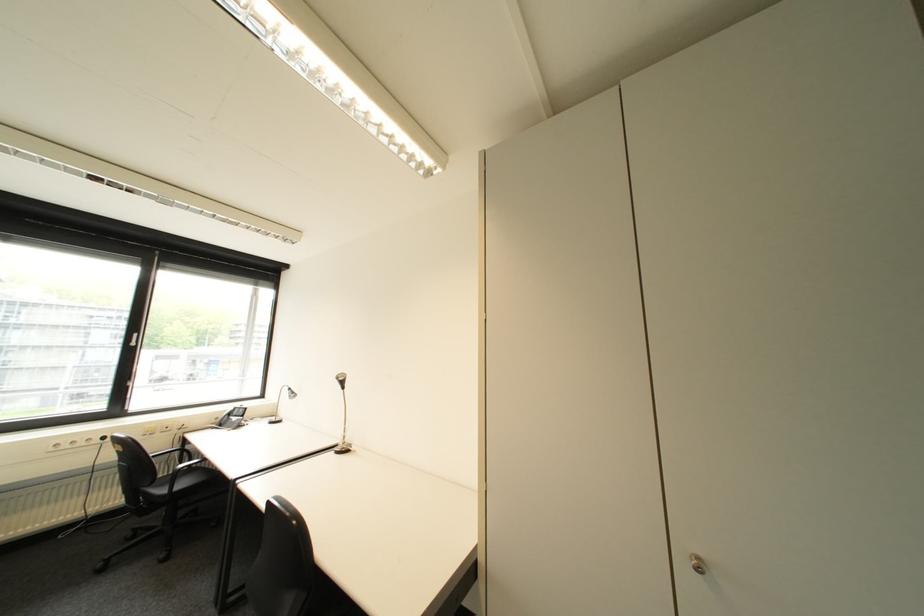
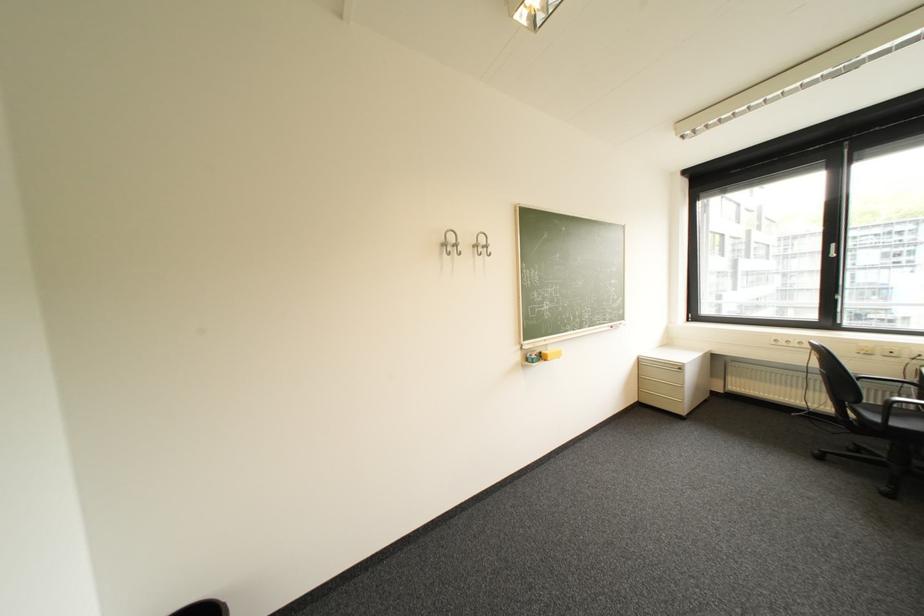
Question: Based on the continuous images, in which direction is the camera rotating? Reply with the corresponding letter.

Choices:
 (A) Left
 (B) Right
 (C) Up
 (D) Down

Answer: (A)